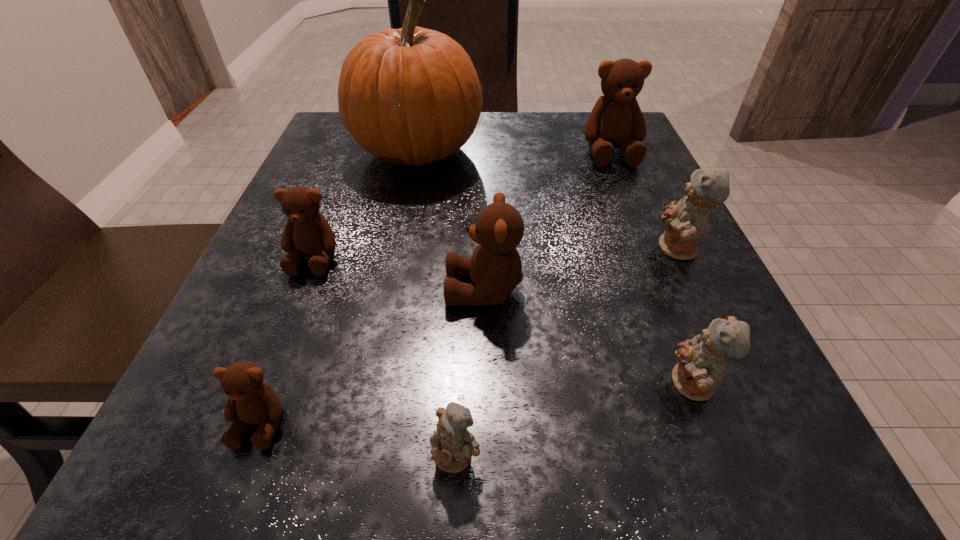
Image resolution: width=960 pixels, height=540 pixels. I want to click on the fourth closest teddy bear to the pumpkin, so click(x=685, y=222).

Where is `brown teddy bear that is the closest to the second brown teddy bear from right to left`? brown teddy bear that is the closest to the second brown teddy bear from right to left is located at coordinates (307, 232).

Select which brown teddy bear is the third closest to the third biggest brown teddy bear. Please provide its 2D coordinates. Your answer should be formatted as a tuple, i.e. [(x, y)], where the tuple contains the x and y coordinates of a point satisfying the conditions above.

[(616, 121)]

Locate which blue teddy bear ranks in proximity to the tallest object. Please provide its 2D coordinates. Your answer should be formatted as a tuple, i.e. [(x, y)], where the tuple contains the x and y coordinates of a point satisfying the conditions above.

[(685, 222)]

Locate which blue teddy bear ranks in proximity to the smallest brown teddy bear. Please provide its 2D coordinates. Your answer should be formatted as a tuple, i.e. [(x, y)], where the tuple contains the x and y coordinates of a point satisfying the conditions above.

[(452, 444)]

At what (x,y) coordinates should I click in order to perform the action: click on free space that satisfies the following two spatial constraints: 1. on the face of the third brown teddy bear from left to right; 2. on the face of the smallest brown teddy bear. Please return your answer as a coordinate pair (x, y). Looking at the image, I should click on point(485,422).

Identify the location of free location that satisfies the following two spatial constraints: 1. on the face of the farthest teddy bear; 2. on the front-facing side of the second farthest blue teddy bear. The width and height of the screenshot is (960, 540). (707, 386).